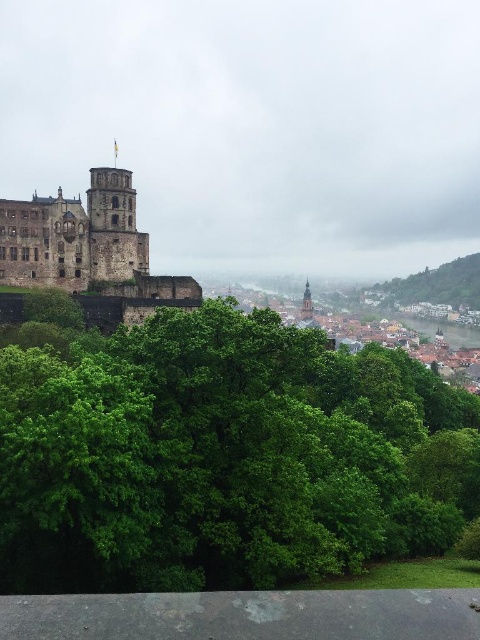
Question: Which object is the farthest from the brown stone castle at left?

Choices:
 (A) green leafy tree at lower right
 (B) green stone tower at center

Answer: (A)

Question: Considering the real-world distances, which object is closest to the green leafy tree at lower right?

Choices:
 (A) green leafy tree at center
 (B) green stone tower at center

Answer: (B)

Question: Which object is closer to the camera taking this photo?

Choices:
 (A) green stone tower at center
 (B) green leafy tree at center

Answer: (B)

Question: Observing the image, what is the correct spatial positioning of brown stone castle at left in reference to green leafy tree at lower right?

Choices:
 (A) right
 (B) left

Answer: (B)

Question: Is green leafy tree at center positioned behind brown stone castle at left?

Choices:
 (A) no
 (B) yes

Answer: (A)

Question: Is brown stone castle at left smaller than green leafy tree at lower right?

Choices:
 (A) yes
 (B) no

Answer: (A)